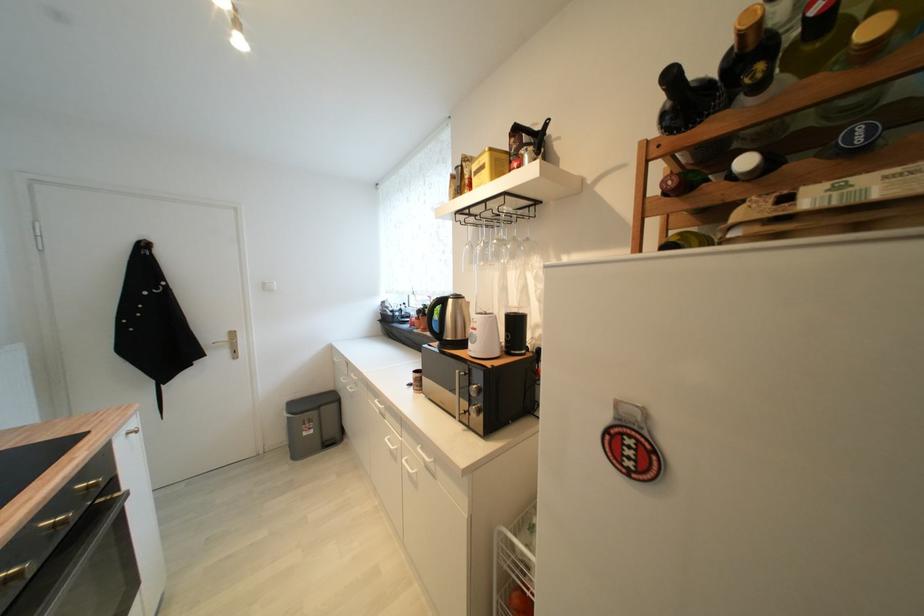
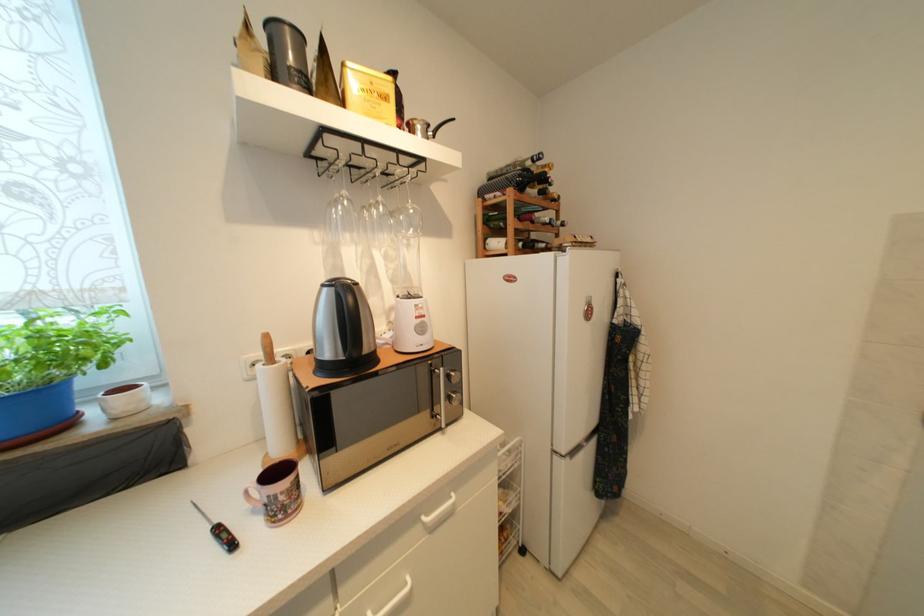
Where in the second image is the point corresponding to point (415, 387) from the first image?

(237, 546)